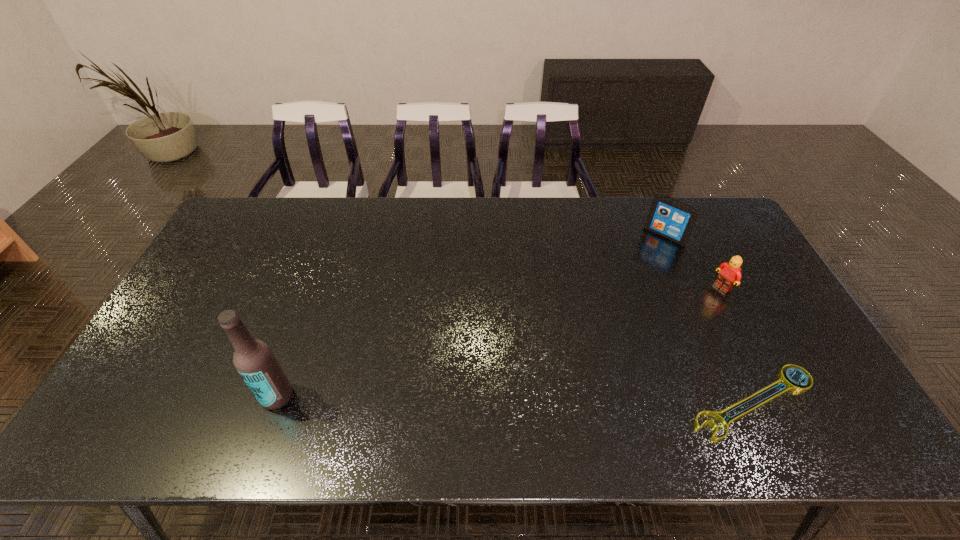
This screenshot has height=540, width=960. Find the location of `the leftmost object`. the leftmost object is located at coordinates 254,360.

Where is `beer bottle`? beer bottle is located at coordinates (254, 360).

Find the location of a particular element. The image size is (960, 540). wrench is located at coordinates (792, 385).

At what (x,y) coordinates should I click in order to perform the action: click on the farthest object. Please return your answer as a coordinate pair (x, y). The width and height of the screenshot is (960, 540). Looking at the image, I should click on (672, 219).

At what (x,y) coordinates should I click in order to perform the action: click on the second farthest object. Please return your answer as a coordinate pair (x, y). Looking at the image, I should click on (730, 274).

Find the location of a particular element. Image resolution: width=960 pixels, height=540 pixels. vacant point located 0.220m on the label of the leftmost object is located at coordinates (172, 396).

Locate an element on the screen. The width and height of the screenshot is (960, 540). free region located on the label of the leftmost object is located at coordinates (196, 396).

Locate an element on the screen. This screenshot has height=540, width=960. free spot located 0.070m on the label of the leftmost object is located at coordinates (232, 396).

The height and width of the screenshot is (540, 960). What are the coordinates of `vacant space located 0.090m on the left of the wrench` in the screenshot? It's located at (650, 402).

Find the location of a particular element. The height and width of the screenshot is (540, 960). free space located on the front screen of the iPod is located at coordinates (600, 307).